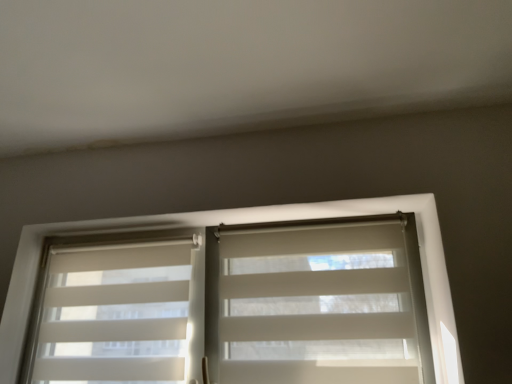
Question: Considering the relative sizes of white translucent blinds at center and white textured blinds at left in the image provided, is white translucent blinds at center shorter than white textured blinds at left?

Choices:
 (A) no
 (B) yes

Answer: (A)

Question: Is white translucent blinds at center smaller than white textured blinds at left?

Choices:
 (A) no
 (B) yes

Answer: (A)

Question: Does white translucent blinds at center lie behind white textured blinds at left?

Choices:
 (A) no
 (B) yes

Answer: (A)

Question: Is white translucent blinds at center bigger than white textured blinds at left?

Choices:
 (A) yes
 (B) no

Answer: (A)

Question: Can you confirm if white translucent blinds at center is thinner than white textured blinds at left?

Choices:
 (A) yes
 (B) no

Answer: (B)

Question: In terms of width, does white translucent blinds at center look wider or thinner when compared to white textured blinds at left?

Choices:
 (A) thin
 (B) wide

Answer: (B)

Question: Considering the positions of point (1, 332) and point (78, 301), is point (1, 332) closer or farther from the camera than point (78, 301)?

Choices:
 (A) closer
 (B) farther

Answer: (A)

Question: From the image's perspective, relative to white textured blinds at left, is white translucent blinds at center above or below?

Choices:
 (A) above
 (B) below

Answer: (A)

Question: In terms of height, does white translucent blinds at center look taller or shorter compared to white textured blinds at left?

Choices:
 (A) tall
 (B) short

Answer: (A)

Question: Relative to white textured blinds at left, is white fabric blind at center in front or behind?

Choices:
 (A) front
 (B) behind

Answer: (A)

Question: Considering the positions of point (309, 342) and point (106, 336), is point (309, 342) closer or farther from the camera than point (106, 336)?

Choices:
 (A) farther
 (B) closer

Answer: (B)

Question: Is white fabric blind at center to the left or to the right of white textured blinds at left in the image?

Choices:
 (A) right
 (B) left

Answer: (A)

Question: In terms of width, does white fabric blind at center look wider or thinner when compared to white textured blinds at left?

Choices:
 (A) thin
 (B) wide

Answer: (B)

Question: From the image's perspective, is white textured blinds at left located above or below white fabric blind at center?

Choices:
 (A) above
 (B) below

Answer: (B)

Question: In the image, is white textured blinds at left on the left side or the right side of white fabric blind at center?

Choices:
 (A) left
 (B) right

Answer: (A)